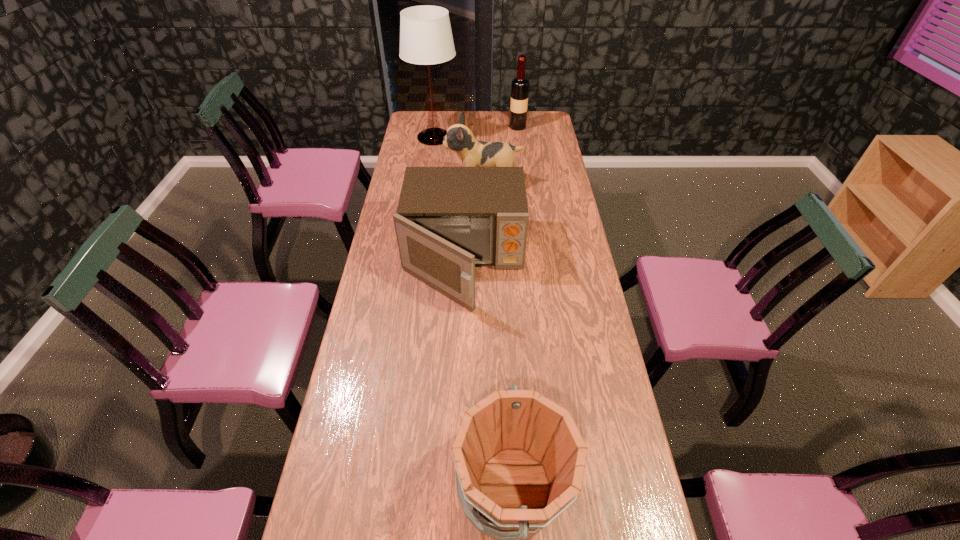
At what (x,y) coordinates should I click in order to perform the action: click on free space at the right edge of the desktop. Please return your answer as a coordinate pair (x, y). Looking at the image, I should click on (527, 136).

At what (x,y) coordinates should I click in order to perform the action: click on vacant region between the tallest object and the third farthest object. Please return your answer as a coordinate pair (x, y). The height and width of the screenshot is (540, 960). Looking at the image, I should click on (459, 160).

Find the location of a particular element. This screenshot has width=960, height=540. free space between the table lamp and the wine bottle is located at coordinates (476, 132).

In order to click on free space between the third nearest object and the table lamp in this screenshot , I will do `click(459, 160)`.

This screenshot has width=960, height=540. Find the location of `object that is the fourth closest to the microwave oven`. object that is the fourth closest to the microwave oven is located at coordinates (520, 86).

Identify which object is located as the second nearest to the bucket. Please provide its 2D coordinates. Your answer should be formatted as a tuple, i.e. [(x, y)], where the tuple contains the x and y coordinates of a point satisfying the conditions above.

[(459, 138)]